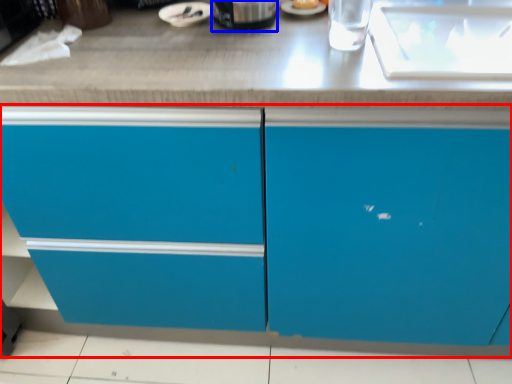
Question: Which object appears farthest to the camera in this image, cabinetry (highlighted by a red box) or appliance (highlighted by a blue box)?

Choices:
 (A) cabinetry
 (B) appliance

Answer: (B)